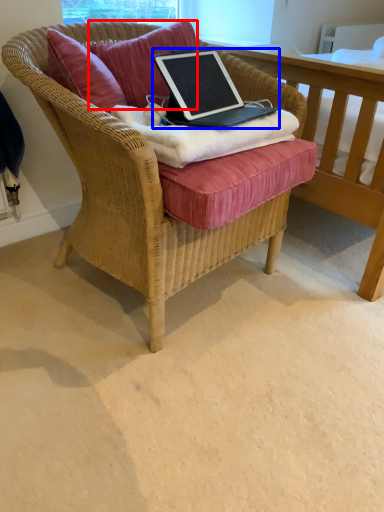
Question: Which object appears farthest to the camera in this image, pillow (highlighted by a red box) or laptop (highlighted by a blue box)?

Choices:
 (A) pillow
 (B) laptop

Answer: (A)